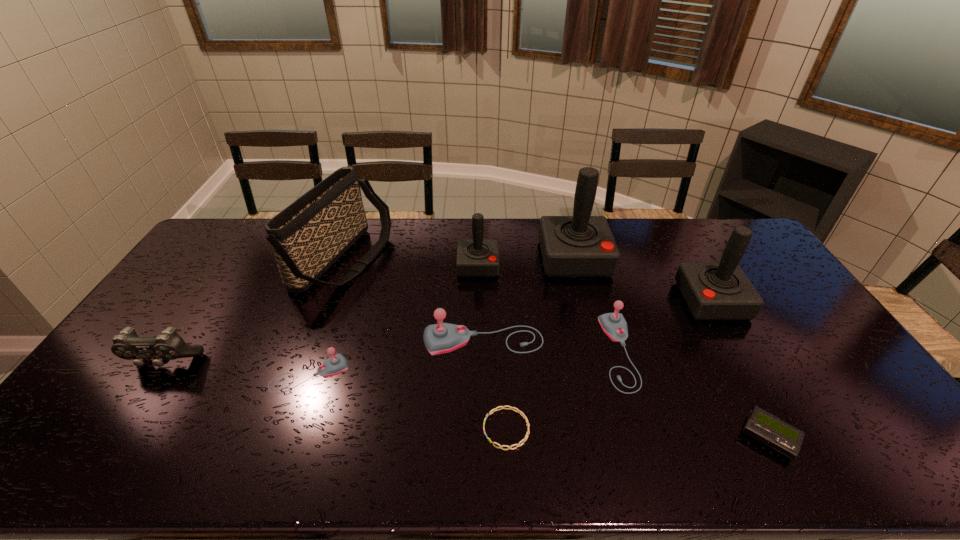
In order to click on free spot that satisfies the following two spatial constraints: 1. on the base of the rightmost joystick; 2. on the surface of the leftmost object with buttons in this screenshot , I will do `click(747, 363)`.

Where is `vacant space that satisfies the following two spatial constraints: 1. on the front side of the fourth tallest joystick; 2. on the right side of the second shortest joystick`? vacant space that satisfies the following two spatial constraints: 1. on the front side of the fourth tallest joystick; 2. on the right side of the second shortest joystick is located at coordinates [484, 352].

Image resolution: width=960 pixels, height=540 pixels. Find the location of `vacant space that satisfies the following two spatial constraints: 1. on the base of the tallest joystick; 2. on the surface of the bracelet showing star-shaped elements`. vacant space that satisfies the following two spatial constraints: 1. on the base of the tallest joystick; 2. on the surface of the bracelet showing star-shaped elements is located at coordinates (618, 429).

At what (x,y) coordinates should I click in order to perform the action: click on free space that satisfies the following two spatial constraints: 1. on the base of the tallest joystick; 2. on the surface of the blue bracelet showing star-shaped elements. Please return your answer as a coordinate pair (x, y). Looking at the image, I should click on (618, 429).